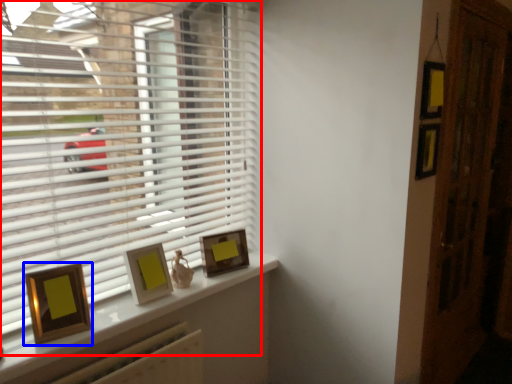
Question: Which of the following is the farthest to the observer, window blind (highlighted by a red box) or picture frame (highlighted by a blue box)?

Choices:
 (A) window blind
 (B) picture frame

Answer: (B)